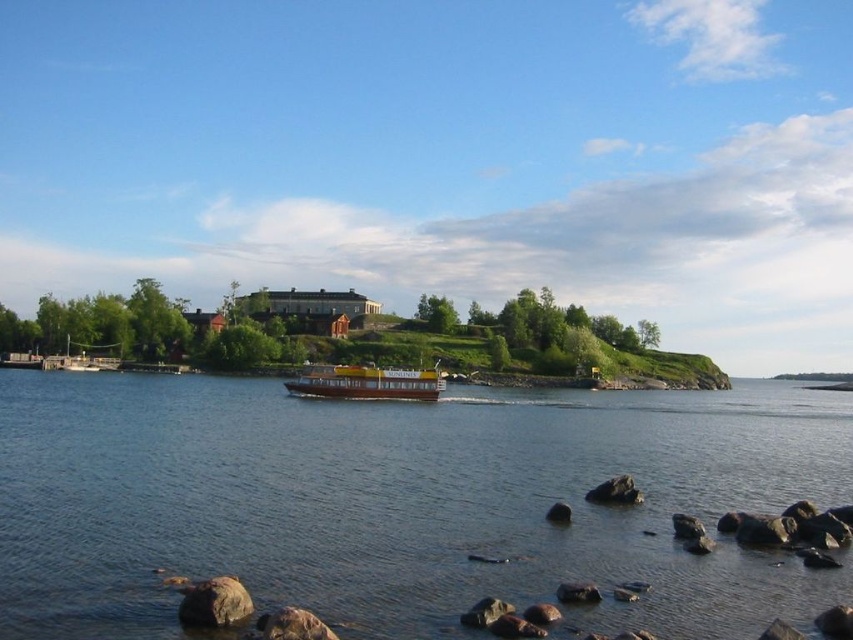
Between point (323, 380) and point (73, 355), which one is positioned in front?

Point (323, 380) is in front.

Looking at this image, who is more distant from viewer, (405, 385) or (113, 349)?

Positioned behind is point (113, 349).

Identify the location of yellow matte boat at center. The width and height of the screenshot is (853, 640). [x=367, y=381].

In the scene shown: Is blue water at center behind yellow matte boat at center?

No, it is in front of yellow matte boat at center.

Between blue water at center and yellow matte boat at center, which one appears on the right side from the viewer's perspective?

yellow matte boat at center

Locate an element on the screen. blue water at center is located at coordinates (401, 502).

Can you confirm if blue water at center is shorter than wooden dock at lower left?

Correct, blue water at center is not as tall as wooden dock at lower left.

Does blue water at center appear over wooden dock at lower left?

Incorrect, blue water at center is not positioned above wooden dock at lower left.

Which is behind, point (96, 451) or point (50, 358)?

The point (50, 358) is more distant.

Identify the location of blue water at center. coord(401,502).